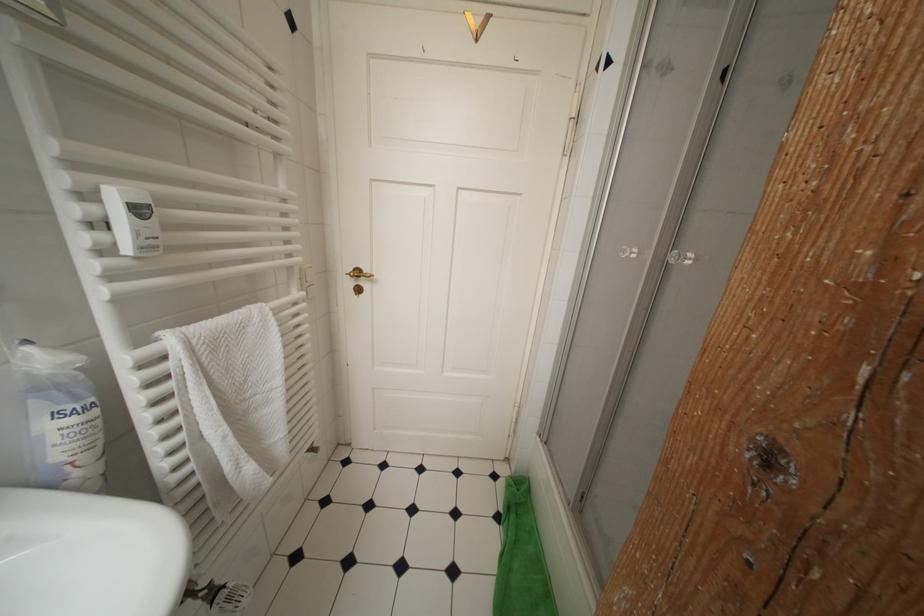
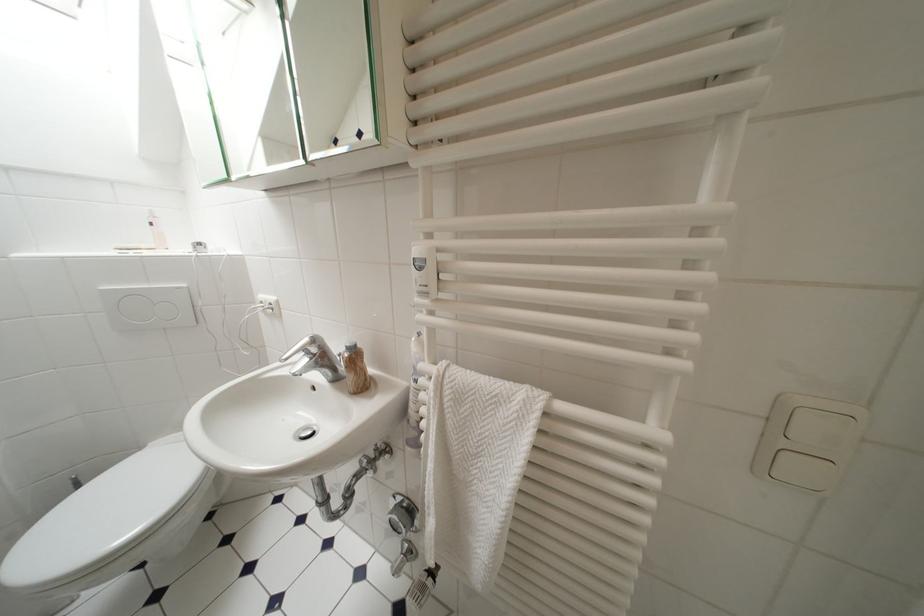
Find the pixel in the second image that matches (193,367) in the first image.

(439, 397)